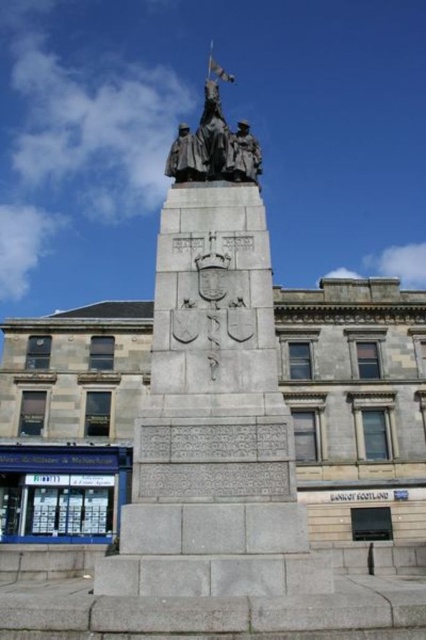
Question: Which object appears farthest from the camera in this image?

Choices:
 (A) polished bronze statue at center
 (B) bronze statue at center

Answer: (A)

Question: Is bronze statue at center to the left of polished bronze statue at center from the viewer's perspective?

Choices:
 (A) no
 (B) yes

Answer: (B)

Question: Which point is closer to the camera?

Choices:
 (A) polished bronze statue at center
 (B) bronze statue at center

Answer: (B)

Question: Is bronze statue at center positioned in front of polished bronze statue at center?

Choices:
 (A) no
 (B) yes

Answer: (B)

Question: Does bronze statue at center appear on the left side of polished bronze statue at center?

Choices:
 (A) no
 (B) yes

Answer: (B)